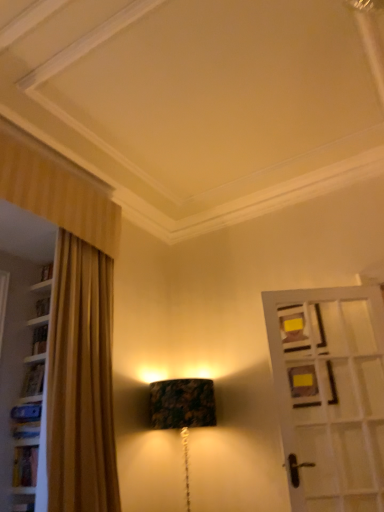
Question: Considering the positions of white wooden door at right and marble-patterned lampshade at center in the image, is white wooden door at right taller or shorter than marble-patterned lampshade at center?

Choices:
 (A) short
 (B) tall

Answer: (B)

Question: Based on their sizes in the image, would you say white wooden door at right is bigger or smaller than marble-patterned lampshade at center?

Choices:
 (A) big
 (B) small

Answer: (B)

Question: Considering the positions of point (302, 391) and point (153, 416), is point (302, 391) closer or farther from the camera than point (153, 416)?

Choices:
 (A) closer
 (B) farther

Answer: (A)

Question: Is marble-patterned lampshade at center to the left or to the right of white wooden door at right in the image?

Choices:
 (A) left
 (B) right

Answer: (A)

Question: From the image's perspective, is marble-patterned lampshade at center positioned above or below white wooden door at right?

Choices:
 (A) above
 (B) below

Answer: (B)

Question: From a real-world perspective, is marble-patterned lampshade at center positioned above or below white wooden door at right?

Choices:
 (A) above
 (B) below

Answer: (B)

Question: In terms of width, does marble-patterned lampshade at center look wider or thinner when compared to white wooden door at right?

Choices:
 (A) wide
 (B) thin

Answer: (A)